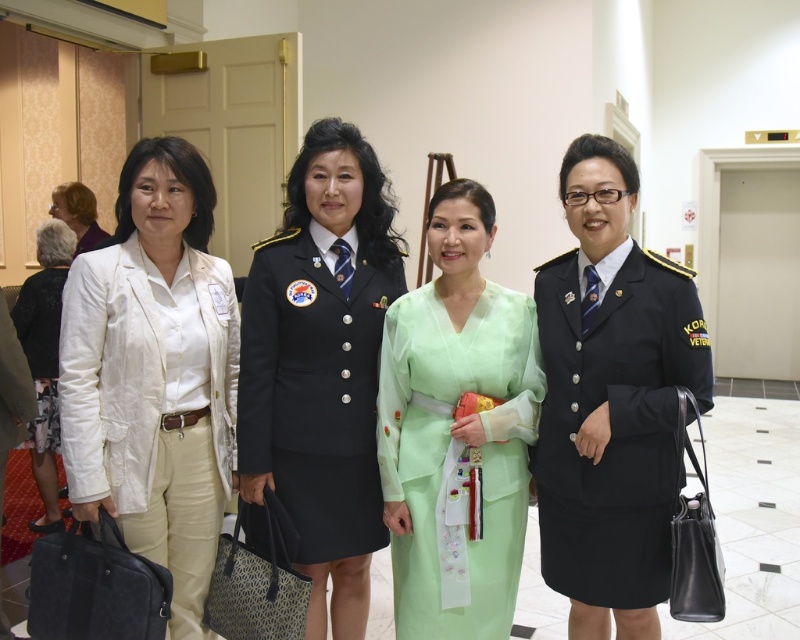
Locate an element on the screen. light beige pantsuit at left is located at coordinates (44, 358).

Between light beige pantsuit at left and light brown hair at upper left, which one has more height?

light beige pantsuit at left

Where is `light beige pantsuit at left`? The height and width of the screenshot is (640, 800). light beige pantsuit at left is located at coordinates (44, 358).

Does white linen blazer at left have a larger size compared to light green silk dress at center?

Yes, white linen blazer at left is bigger than light green silk dress at center.

Looking at this image, which is below, white linen blazer at left or light green silk dress at center?

light green silk dress at center is below.

Between point (168, 440) and point (400, 620), which one is positioned in front?

Positioned in front is point (168, 440).

Where is `white linen blazer at left`? The image size is (800, 640). white linen blazer at left is located at coordinates (152, 406).

Does navy blue uniform at center appear on the left side of light beige pantsuit at left?

No, navy blue uniform at center is not to the left of light beige pantsuit at left.

Locate an element on the screen. The width and height of the screenshot is (800, 640). navy blue uniform at center is located at coordinates pyautogui.click(x=314, y=392).